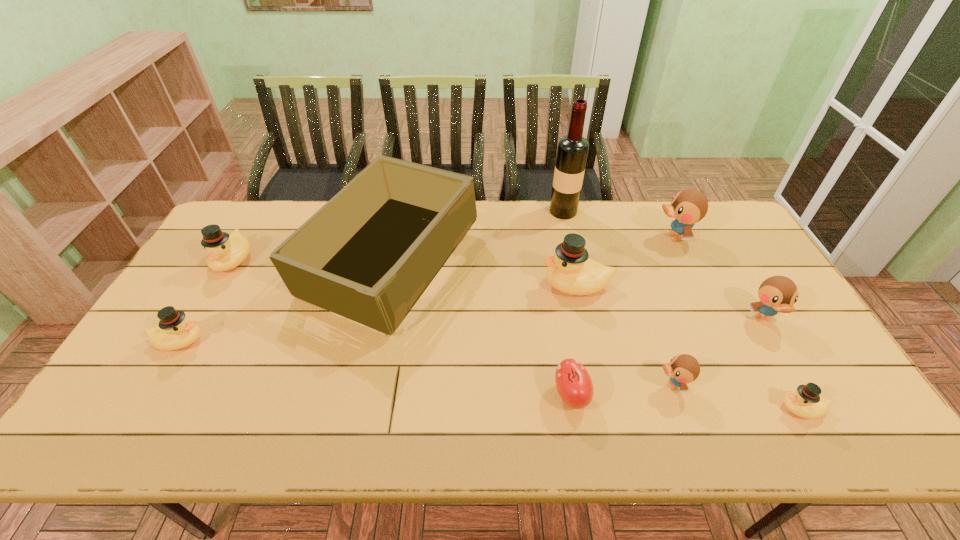
Where is `the third biggest yellow duck`? This screenshot has height=540, width=960. the third biggest yellow duck is located at coordinates (174, 331).

At what (x,y) coordinates should I click in order to perform the action: click on apple. Please return your answer as a coordinate pair (x, y). This screenshot has width=960, height=540. Looking at the image, I should click on (573, 382).

Image resolution: width=960 pixels, height=540 pixels. In order to click on the smallest blue duck in this screenshot , I will do `click(683, 368)`.

I want to click on the fourth object from right to left, so [x=683, y=368].

This screenshot has width=960, height=540. I want to click on the rightmost yellow duck, so (x=805, y=402).

Where is `the smallest yellow duck`? The image size is (960, 540). the smallest yellow duck is located at coordinates (805, 402).

Identify the location of vacant area located on the left of the tallest object. Image resolution: width=960 pixels, height=540 pixels. (514, 211).

Find the location of a particular element. Image resolution: width=960 pixels, height=540 pixels. vacant region located on the left of the box is located at coordinates (228, 264).

The width and height of the screenshot is (960, 540). Find the location of `vacant space located on the front-facing side of the farthest blue duck`. vacant space located on the front-facing side of the farthest blue duck is located at coordinates (602, 237).

The width and height of the screenshot is (960, 540). What are the coordinates of `free space located 0.170m on the front-facing side of the farthest blue duck` in the screenshot? It's located at pos(602,237).